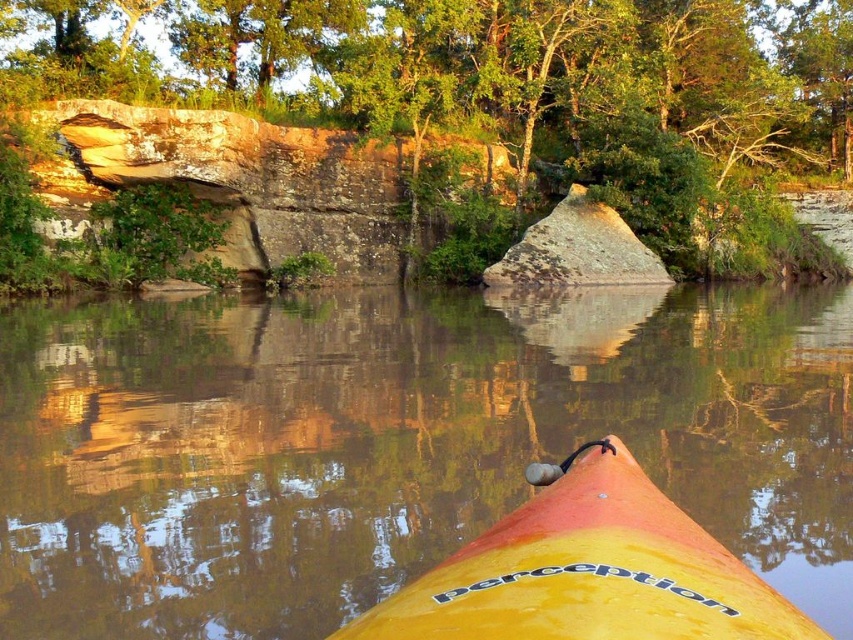
Question: Is brown reflective water at center smaller than yellow matte kayak at center?

Choices:
 (A) yes
 (B) no

Answer: (B)

Question: Does yellow matte kayak at center appear under rusty metallic rock at center?

Choices:
 (A) no
 (B) yes

Answer: (B)

Question: Is green leafy tree at upper center further to the viewer compared to rusty metallic rock at center?

Choices:
 (A) no
 (B) yes

Answer: (A)

Question: Considering the real-world distances, which object is closest to the green leafy tree at upper center?

Choices:
 (A) yellow matte kayak at center
 (B) brown reflective water at center

Answer: (B)

Question: Which point is closer to the camera?

Choices:
 (A) (740, 605)
 (B) (543, 220)

Answer: (A)

Question: Which of the following is the farthest from the observer?

Choices:
 (A) (3, 394)
 (B) (134, 67)
 (C) (624, 228)

Answer: (C)